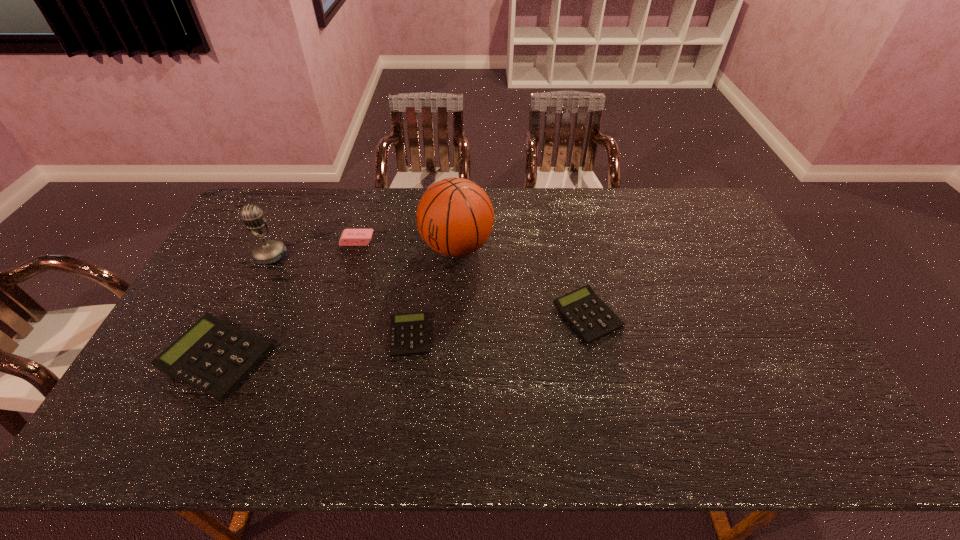
In the image, there is a desktop. Where is `vacant space at the far edge`? This screenshot has height=540, width=960. vacant space at the far edge is located at coordinates tap(350, 221).

The width and height of the screenshot is (960, 540). Identify the location of vacant space at the near edge. (302, 394).

Where is `blank area at the left edge`? This screenshot has height=540, width=960. blank area at the left edge is located at coordinates (221, 265).

This screenshot has width=960, height=540. I want to click on vacant area at the right edge, so click(743, 342).

Locate an element on the screen. vacant area at the far left corner is located at coordinates (287, 217).

Locate an element on the screen. The image size is (960, 540). vacant space that is in between the second tallest object and the shortest object is located at coordinates (340, 296).

Locate an element on the screen. free space that is in between the fourth object from right to left and the second tallest object is located at coordinates (314, 248).

This screenshot has width=960, height=540. I want to click on empty location between the rightmost calculator and the second calculator from right to left, so click(x=499, y=326).

You are a GUI agent. You are given a task and a screenshot of the screen. Output one action in this format:
    pyautogui.click(x=<x>, y=<y>)
    Task: Click on the free spot between the third object from left to right and the tallest object
    
    Given the screenshot: What is the action you would take?
    pyautogui.click(x=407, y=244)

At what (x,y) coordinates should I click in order to perform the action: click on unoccupied position between the third shortest object and the fourth object from right to left. Please return your answer as a coordinate pair (x, y). The width and height of the screenshot is (960, 540). Looking at the image, I should click on tap(287, 299).